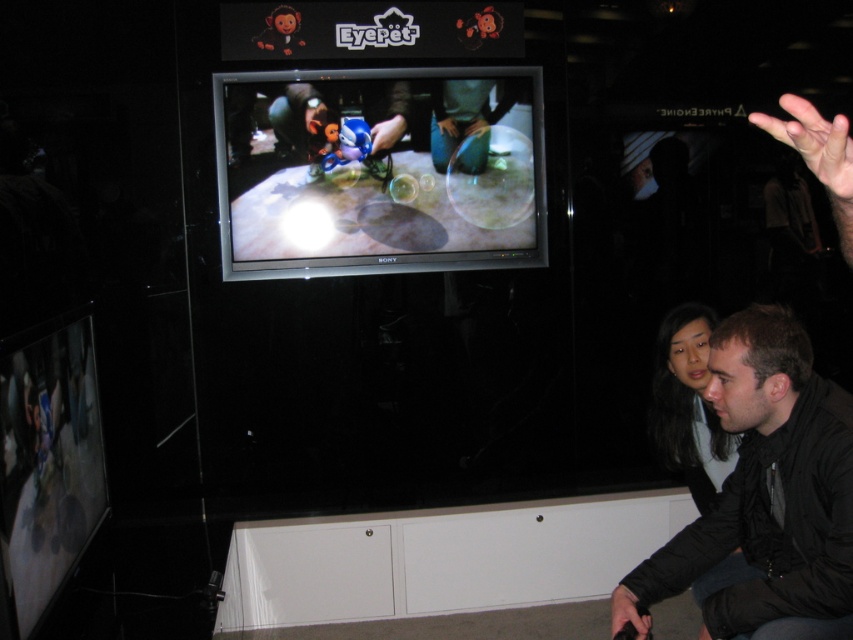
Question: Is shiny silver tv at center bigger than dark brown hair at lower right?

Choices:
 (A) no
 (B) yes

Answer: (B)

Question: Is shiny silver tv at center bigger than dark brown hair at lower right?

Choices:
 (A) no
 (B) yes

Answer: (B)

Question: Which is farther from the black matte jacket at lower right?

Choices:
 (A) shiny silver tv at center
 (B) dark brown hair at lower right

Answer: (A)

Question: Which of the following is the closest to the observer?

Choices:
 (A) dark brown hair at lower right
 (B) shiny silver tv at center

Answer: (A)

Question: Among these points, which one is farthest from the camera?

Choices:
 (A) (737, 499)
 (B) (463, 237)
 (C) (708, 416)

Answer: (B)

Question: Does shiny silver tv at center have a larger size compared to black matte jacket at lower right?

Choices:
 (A) yes
 (B) no

Answer: (B)